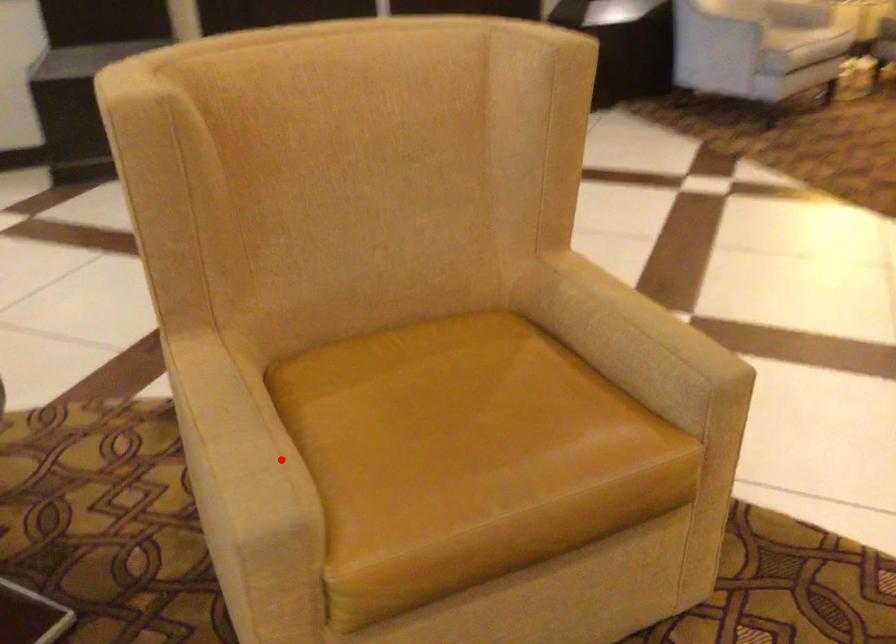
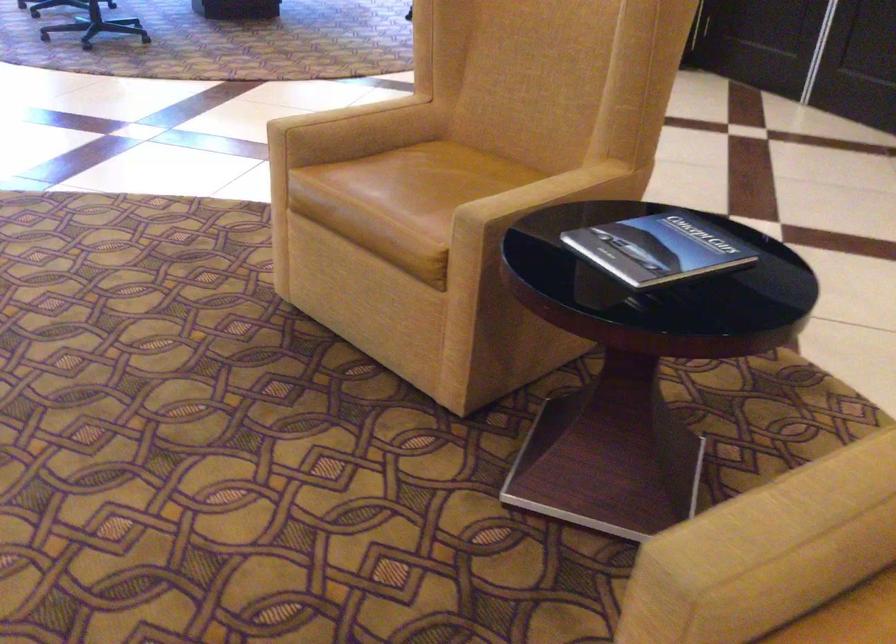
Find the pixel in the second image that matches the highlighted location in the first image.

(778, 543)